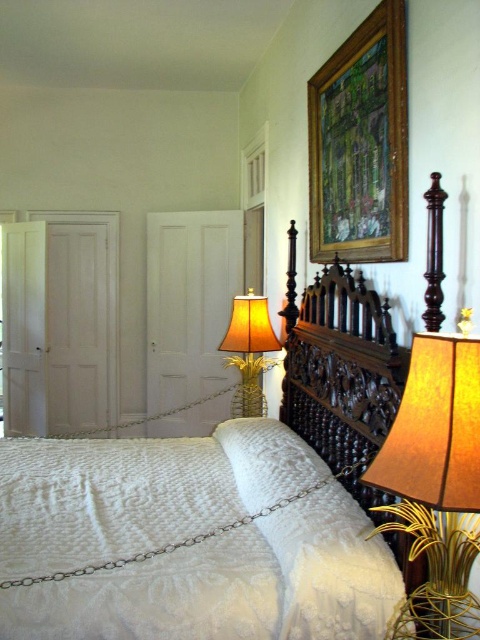
Consider the image. You are standing in the bedroom and want to move from the gold metallic pineapple at center to the gold textured lampshade at right. Which direction should you move?

You should move to the right to reach the gold textured lampshade at right from the gold metallic pineapple at center since it is positioned to the right of it.

Looking at this image, you are standing in the bedroom and want to determine the relative positions of two points marked in the scene. Which point is closer to you, point (332, 470) or point (462, 333)?

Point (332, 470) is further to the camera than point (462, 333), so point (462, 333) is closer to you.